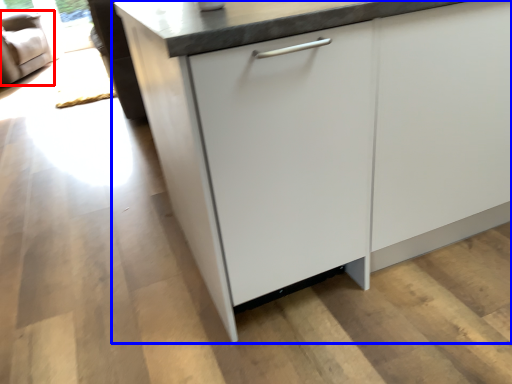
Question: Which object is closer to the camera taking this photo, armchair (highlighted by a red box) or cabinetry (highlighted by a blue box)?

Choices:
 (A) armchair
 (B) cabinetry

Answer: (B)